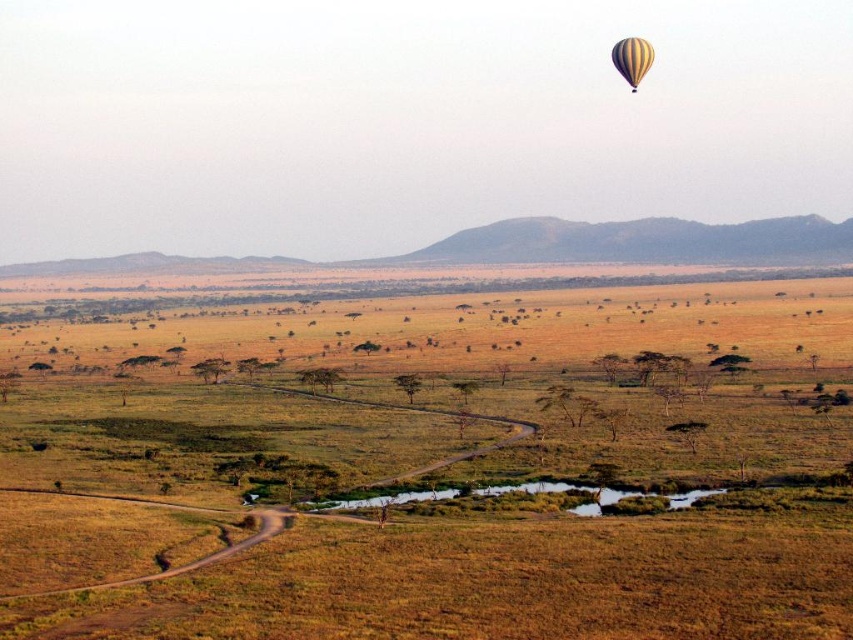
Question: Which point appears closest to the camera in this image?

Choices:
 (A) (666, 440)
 (B) (643, 74)

Answer: (A)

Question: Does brown grassland at center appear on the right side of yellow striped balloon at upper right?

Choices:
 (A) no
 (B) yes

Answer: (A)

Question: Which point appears closest to the camera in this image?

Choices:
 (A) (637, 68)
 (B) (235, 593)

Answer: (B)

Question: Is brown grassland at center to the left of yellow striped balloon at upper right from the viewer's perspective?

Choices:
 (A) yes
 (B) no

Answer: (A)

Question: Does brown grassland at center have a greater width compared to yellow striped balloon at upper right?

Choices:
 (A) yes
 (B) no

Answer: (A)